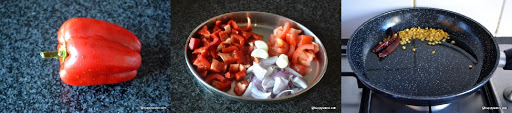
The image size is (512, 113). Find the location of `tray`. tray is located at coordinates (311, 85).